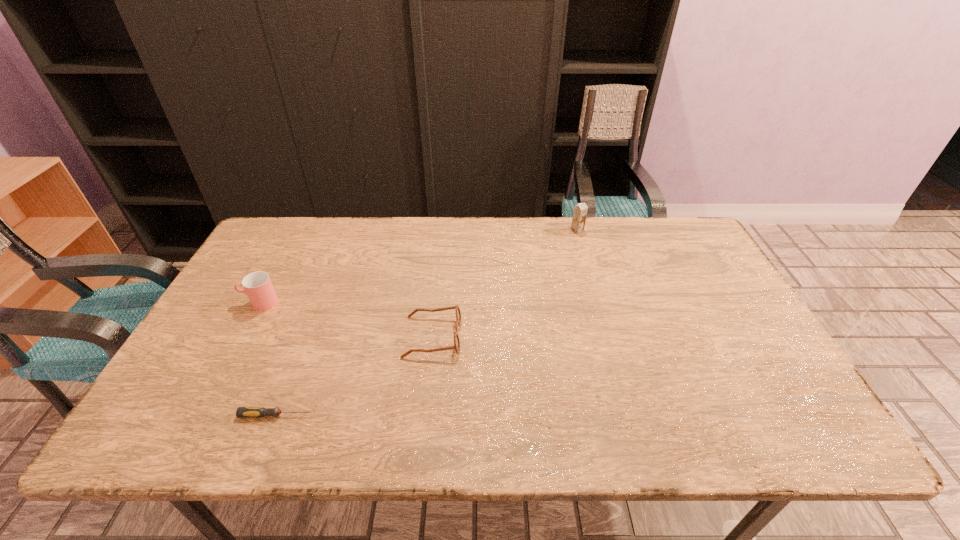
Where is `vacant space located on the front-facing side of the third tallest object`? vacant space located on the front-facing side of the third tallest object is located at coordinates (480, 336).

The width and height of the screenshot is (960, 540). In order to click on free space located 0.060m insert the screwdriver into a screw head in this screenshot , I will do `click(342, 415)`.

Where is `object located at the far edge`? The image size is (960, 540). object located at the far edge is located at coordinates (580, 211).

Find the location of a particular element. object present at the near edge is located at coordinates tap(242, 412).

The image size is (960, 540). What are the coordinates of `object that is at the left edge` in the screenshot? It's located at (257, 285).

This screenshot has width=960, height=540. In the image, there is a desktop. Identify the location of free space at the far edge. (382, 248).

What are the coordinates of `free space at the left edge` in the screenshot? It's located at (233, 282).

In the image, there is a desktop. What are the coordinates of `vacant space at the far left corner` in the screenshot? It's located at (300, 227).

Locate an element on the screen. The width and height of the screenshot is (960, 540). vacant area at the near left corner is located at coordinates (162, 427).

You are a GUI agent. You are given a task and a screenshot of the screen. Output one action in this format:
    pyautogui.click(x=<x>, y=<y>)
    Task: Click on the free space at the near right corner
    
    Given the screenshot: What is the action you would take?
    click(x=735, y=418)